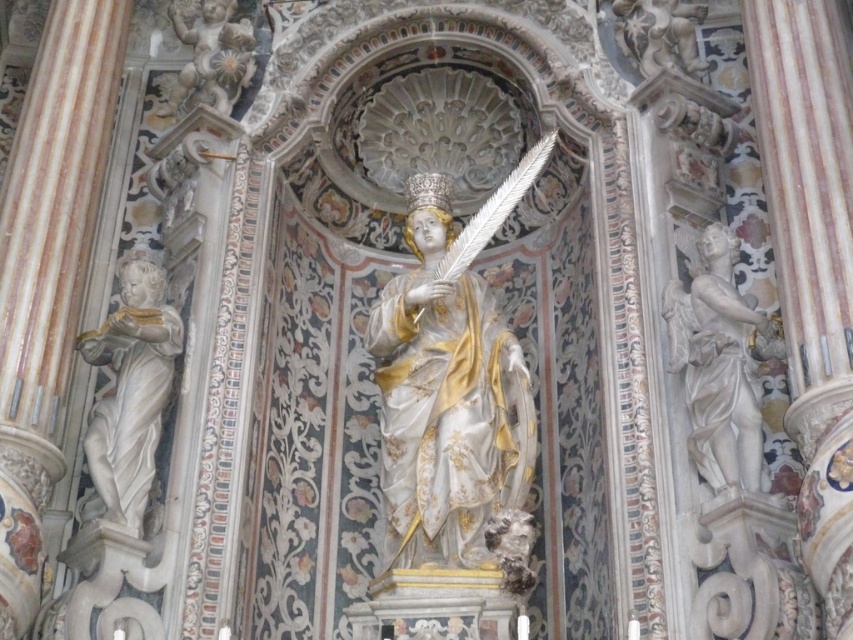
Question: Does white marble statue at right appear on the right side of polished marble cherub at upper left?

Choices:
 (A) no
 (B) yes

Answer: (B)

Question: Which point appears farthest from the camera in this image?

Choices:
 (A) (546, 154)
 (B) (248, 45)
 (C) (160, 420)
 (D) (718, 317)

Answer: (B)

Question: Can you confirm if white marble statue at left is positioned above polished marble cherub at upper left?

Choices:
 (A) no
 (B) yes

Answer: (A)

Question: Which of the following is the farthest from the observer?

Choices:
 (A) (119, 420)
 (B) (722, 454)
 (C) (389, 449)

Answer: (C)

Question: Can you confirm if white marble statue at left is wider than polished marble cherub at upper left?

Choices:
 (A) yes
 (B) no

Answer: (B)

Question: Based on their relative distances, which object is nearer to the white marble statue at right?

Choices:
 (A) polished gold statue at center
 (B) polished marble cherub at upper left
 (C) white marble statue at left

Answer: (A)